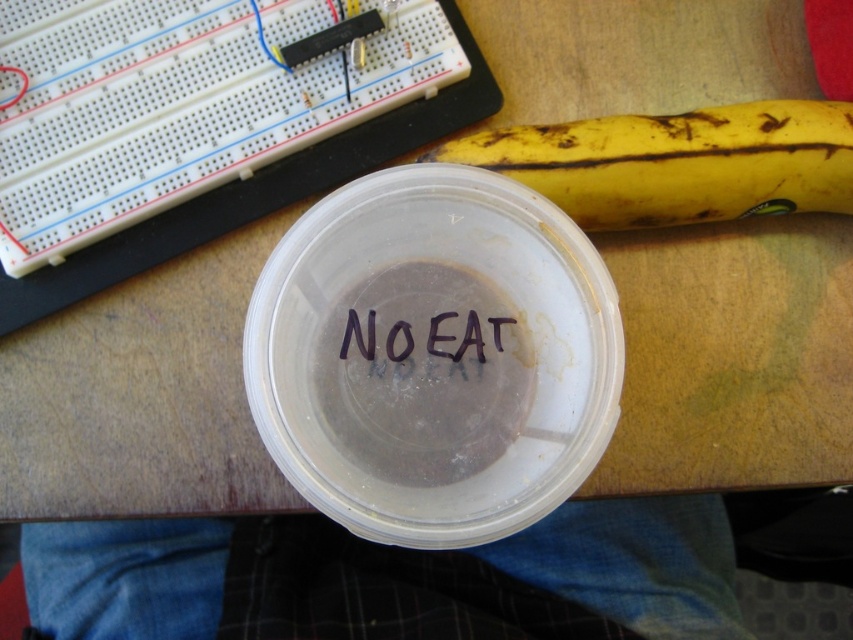
Is yellow matte banana at upper right thinner than black ink writing at center?

In fact, yellow matte banana at upper right might be wider than black ink writing at center.

Who is positioned more to the left, yellow matte banana at upper right or black ink writing at center?

Positioned to the left is black ink writing at center.

Image resolution: width=853 pixels, height=640 pixels. In order to click on yellow matte banana at upper right in this screenshot , I will do `click(677, 163)`.